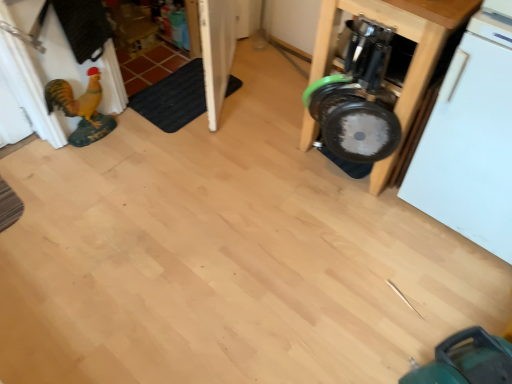
Question: Would you consider white matte dishwasher at right to be distant from metallic silver dumbbell at right?

Choices:
 (A) yes
 (B) no

Answer: (B)

Question: Does white matte dishwasher at right have a greater height compared to metallic silver dumbbell at right?

Choices:
 (A) yes
 (B) no

Answer: (A)

Question: Can we say white matte dishwasher at right lies outside metallic silver dumbbell at right?

Choices:
 (A) no
 (B) yes

Answer: (B)

Question: Is white matte dishwasher at right positioned with its back to metallic silver dumbbell at right?

Choices:
 (A) yes
 (B) no

Answer: (B)

Question: Is white matte dishwasher at right shorter than metallic silver dumbbell at right?

Choices:
 (A) no
 (B) yes

Answer: (A)

Question: Is white matte dishwasher at right to the left or to the right of metallic silver dumbbell at right in the image?

Choices:
 (A) right
 (B) left

Answer: (A)

Question: Looking at the image, does white matte dishwasher at right seem bigger or smaller compared to metallic silver dumbbell at right?

Choices:
 (A) big
 (B) small

Answer: (B)

Question: From the image's perspective, is white matte dishwasher at right above or below metallic silver dumbbell at right?

Choices:
 (A) above
 (B) below

Answer: (B)

Question: From a real-world perspective, is white matte dishwasher at right positioned above or below metallic silver dumbbell at right?

Choices:
 (A) below
 (B) above

Answer: (B)

Question: From the image's perspective, is metallic silver dumbbell at right located above or below black rubber mat at lower left?

Choices:
 (A) above
 (B) below

Answer: (B)

Question: Looking at the image, does metallic silver dumbbell at right seem bigger or smaller compared to black rubber mat at lower left?

Choices:
 (A) small
 (B) big

Answer: (B)

Question: Visually, is metallic silver dumbbell at right positioned to the left or to the right of black rubber mat at lower left?

Choices:
 (A) right
 (B) left

Answer: (A)

Question: From a real-world perspective, relative to black rubber mat at lower left, is metallic silver dumbbell at right vertically above or below?

Choices:
 (A) below
 (B) above

Answer: (B)

Question: Looking at their shapes, would you say metallic silver dumbbell at right is wider or thinner than white matte dishwasher at right?

Choices:
 (A) wide
 (B) thin

Answer: (A)

Question: Visually, is metallic silver dumbbell at right positioned to the left or to the right of white matte dishwasher at right?

Choices:
 (A) left
 (B) right

Answer: (A)